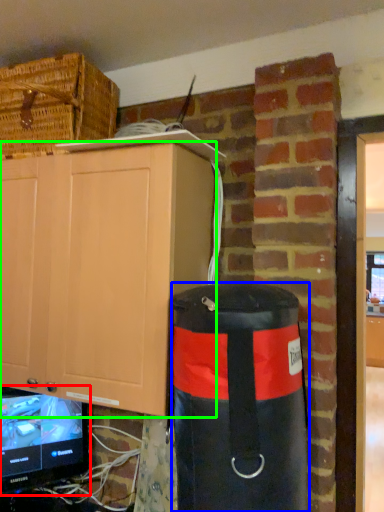
Question: Which object is the farthest from television (highlighted by a red box)? Choose among these: punching bag (highlighted by a blue box) or cabinetry (highlighted by a green box).

Choices:
 (A) punching bag
 (B) cabinetry

Answer: (A)